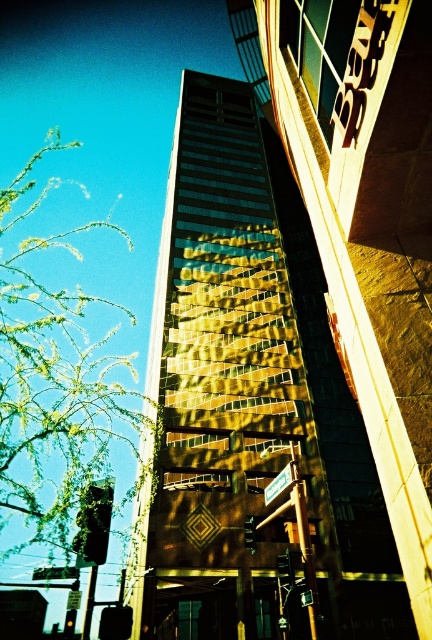
Who is positioned more to the right, gold reflective glass building at center or green leafy branches at left?

gold reflective glass building at center is more to the right.

Between gold reflective glass building at center and green leafy branches at left, which one is positioned higher?

Positioned higher is gold reflective glass building at center.

Find the location of `gold reflective glass building at center`. gold reflective glass building at center is located at coordinates (250, 403).